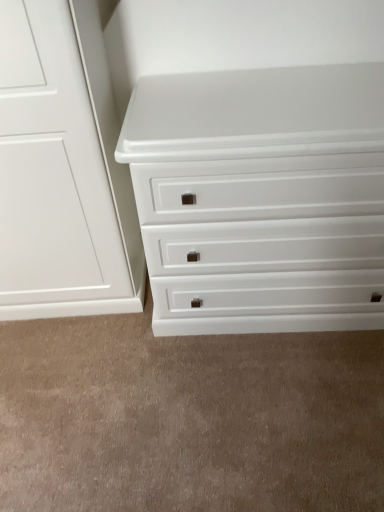
I want to click on free space above white glossy chest of drawers at center (from a real-world perspective), so click(x=218, y=94).